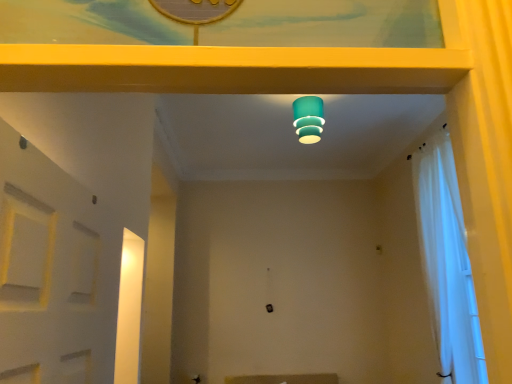
The height and width of the screenshot is (384, 512). What do you see at coordinates (447, 263) in the screenshot?
I see `white sheer curtain at right` at bounding box center [447, 263].

Locate an element on the screen. This screenshot has width=512, height=384. white sheer curtain at right is located at coordinates (447, 263).

Find the location of `white sheer curtain at right`. white sheer curtain at right is located at coordinates (447, 263).